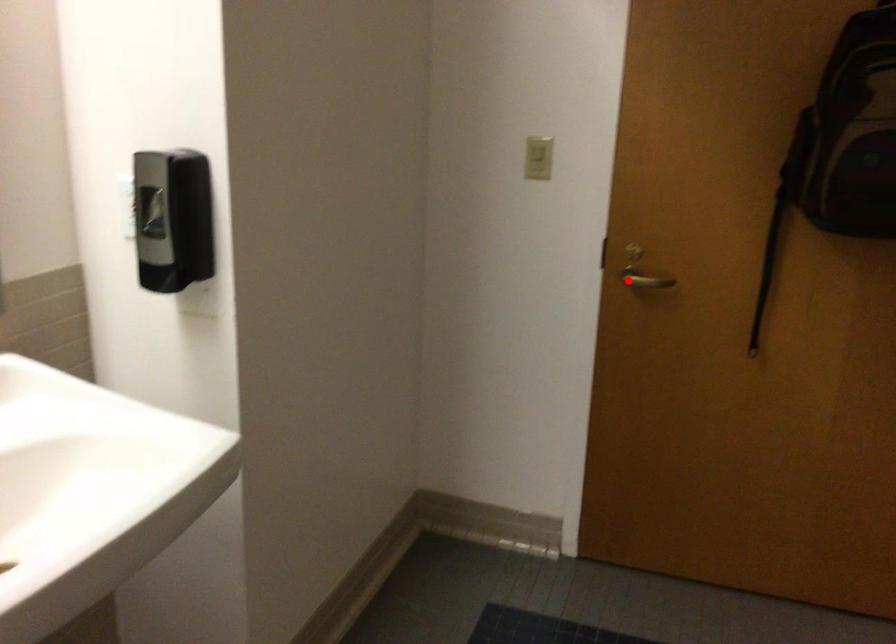
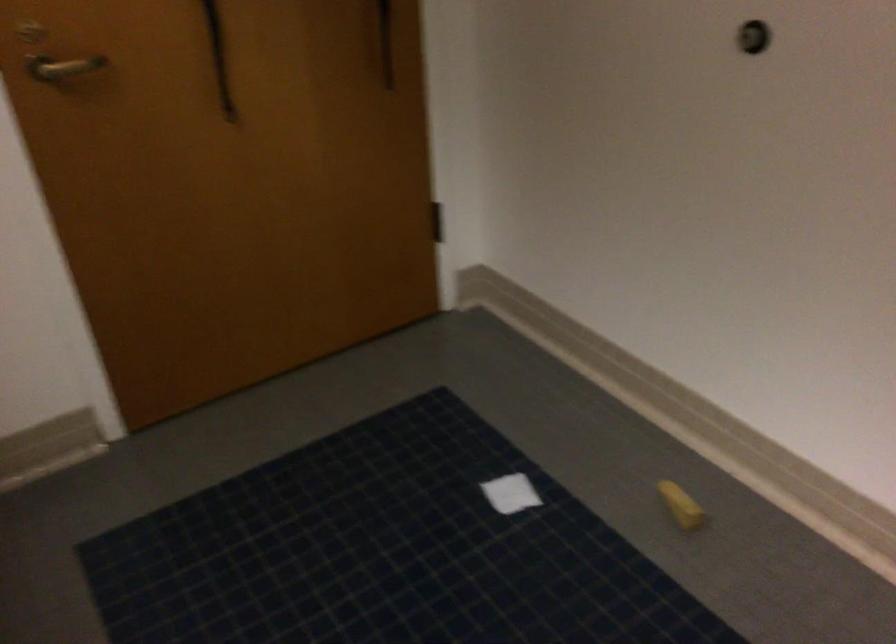
Find the pixel in the second image that matches the highlighted location in the first image.

(62, 67)